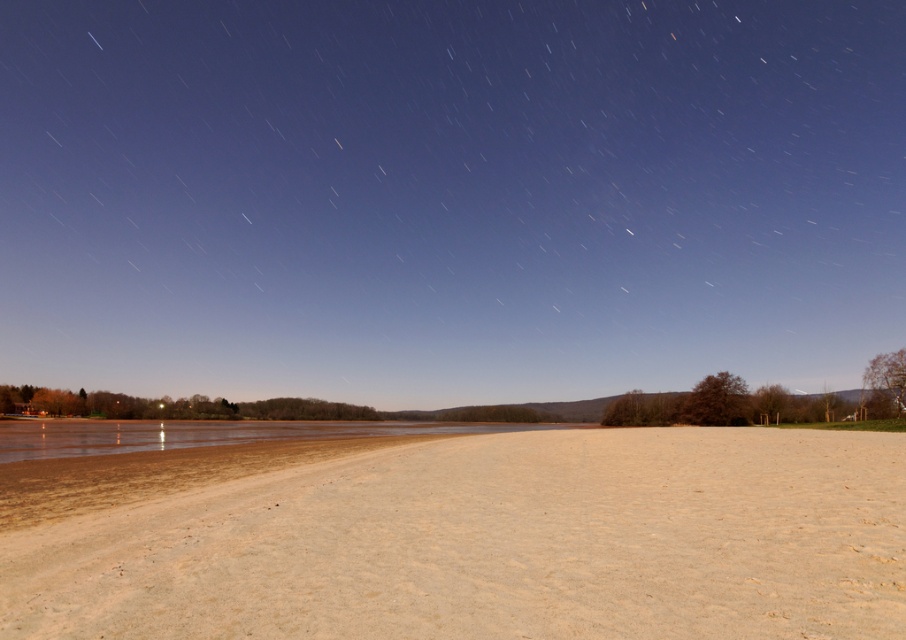
Is smooth sand at lower center taller than sandy beige dirt field at lower center?

Yes.

Is smooth sand at lower center behind sandy beige dirt field at lower center?

Yes, it is.

This screenshot has width=906, height=640. What do you see at coordinates (448, 195) in the screenshot? I see `smooth sand at lower center` at bounding box center [448, 195].

Identify the location of smooth sand at lower center. (448, 195).